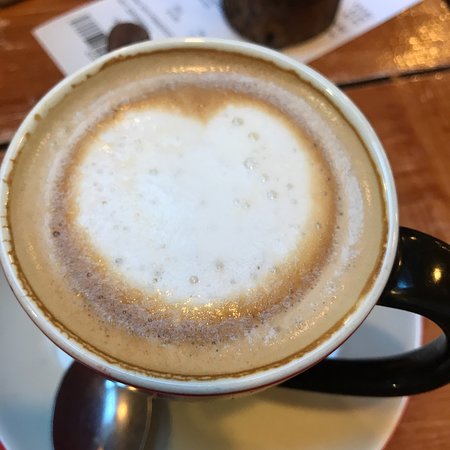
Where is `white rim of coffee cup`? white rim of coffee cup is located at coordinates pyautogui.click(x=372, y=148), pyautogui.click(x=50, y=333), pyautogui.click(x=48, y=95), pyautogui.click(x=291, y=367).